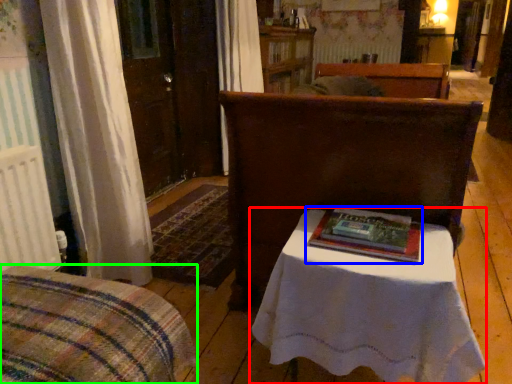
Question: Which object is the closest to the table (highlighted by a red box)? Choose among these: book (highlighted by a blue box) or furniture (highlighted by a green box).

Choices:
 (A) book
 (B) furniture

Answer: (A)